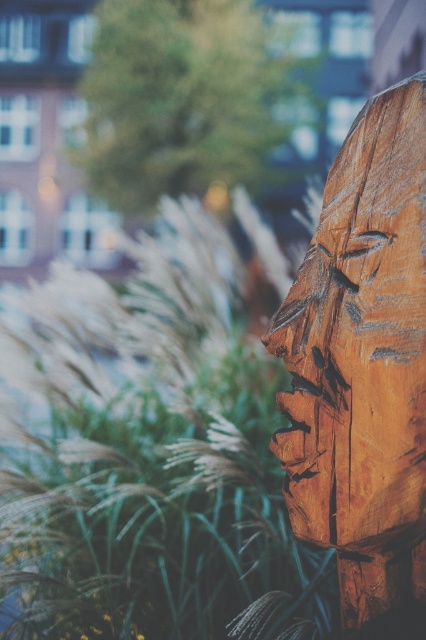
Does green grass at left appear on the right side of natural wood carving at right?

No, green grass at left is not to the right of natural wood carving at right.

Who is lower down, green grass at left or natural wood carving at right?

Positioned lower is green grass at left.

Which is in front, point (267, 396) or point (412, 93)?

Point (412, 93) is in front.

Locate an element on the screen. This screenshot has height=640, width=426. green grass at left is located at coordinates (147, 456).